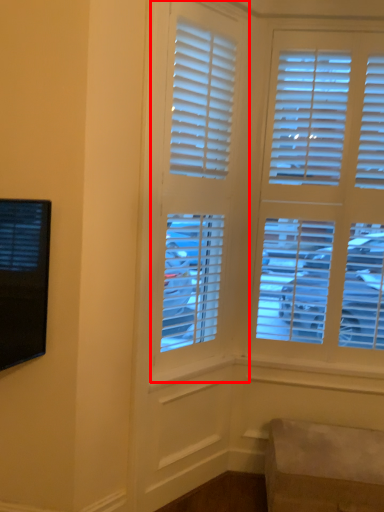
Question: In this image, where is window (annotated by the red box) located relative to furniture?

Choices:
 (A) left
 (B) right

Answer: (A)